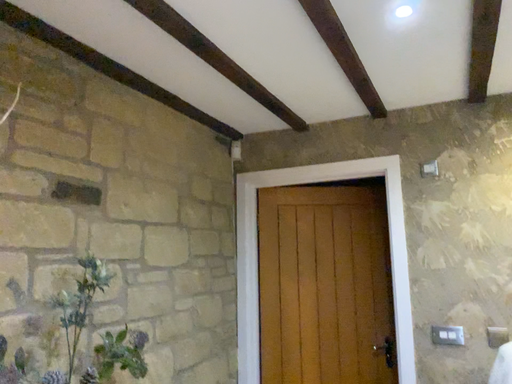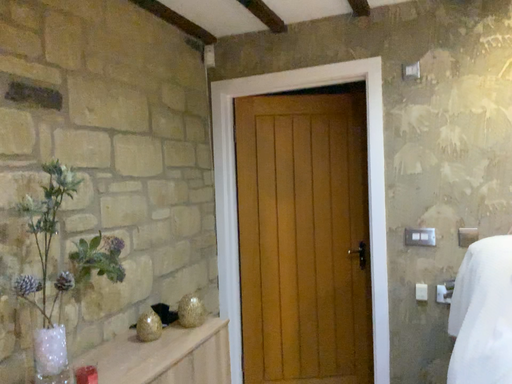
Question: Which way did the camera rotate in the video?

Choices:
 (A) rotated downward
 (B) rotated upward

Answer: (A)